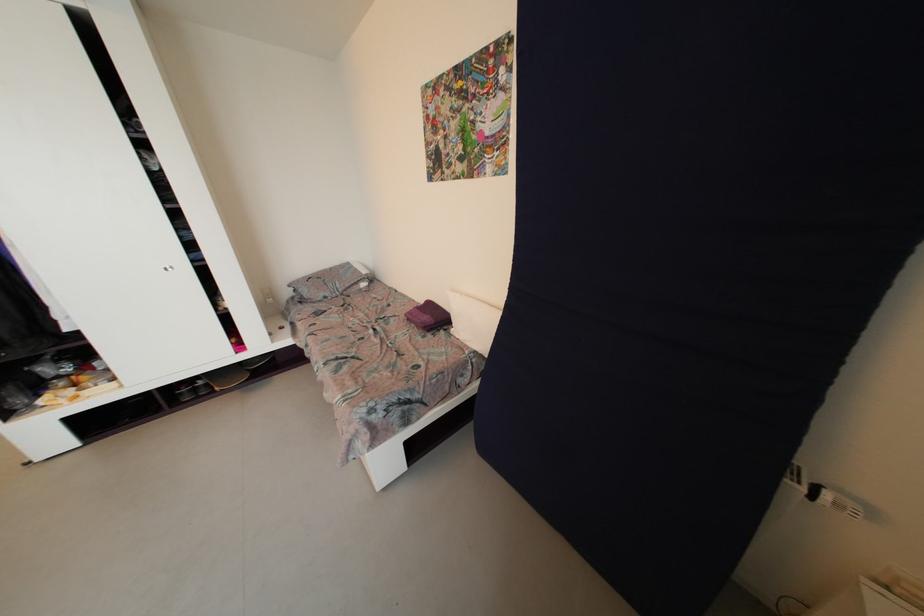
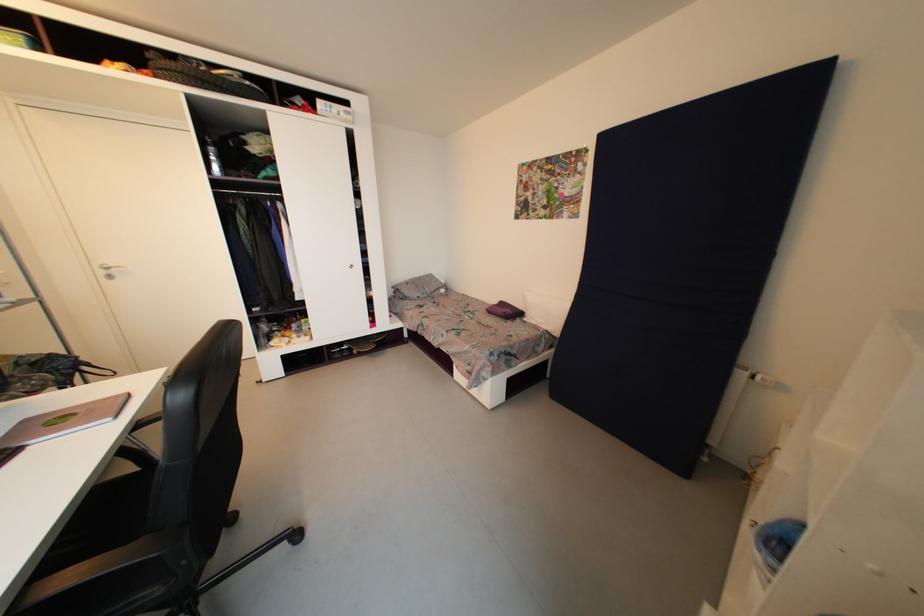
In a continuous first-person perspective shot, in which direction is the camera moving?

The movement direction of the cameraman is left, backward.